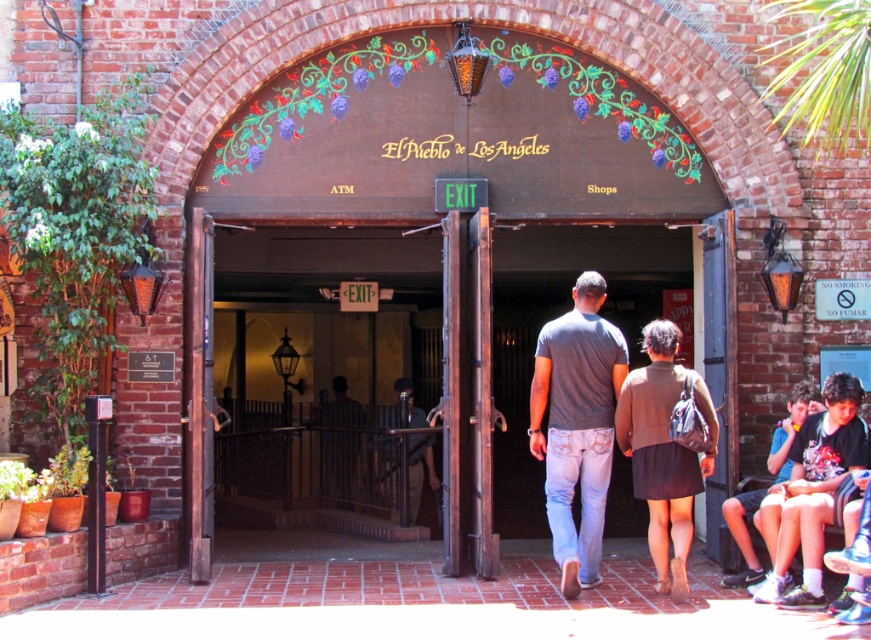
Question: Is gray cotton shirt at center smaller than gray cotton t-shirt at center?

Choices:
 (A) yes
 (B) no

Answer: (B)

Question: Can you confirm if wooden door at center is positioned to the right of blue denim shorts at lower right?

Choices:
 (A) no
 (B) yes

Answer: (A)

Question: Based on their relative distances, which object is nearer to the wooden door at center?

Choices:
 (A) gray cotton shirt at center
 (B) dark brown sweater at center

Answer: (A)

Question: Among these points, which one is nearest to the camera?

Choices:
 (A) (529, 435)
 (B) (525, 460)
 (C) (635, 374)

Answer: (C)

Question: Does gray cotton shirt at center appear on the left side of blue denim shorts at lower right?

Choices:
 (A) no
 (B) yes

Answer: (B)

Question: Which point appears closest to the camera in this image?

Choices:
 (A) (589, 465)
 (B) (322, 445)

Answer: (A)